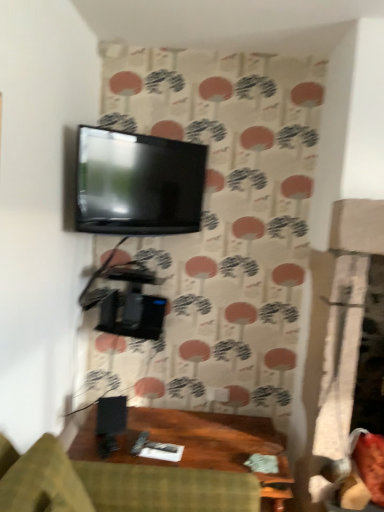
Question: Is green fabric studio couch at lower center with matte black tv at upper center?

Choices:
 (A) no
 (B) yes

Answer: (A)

Question: From a real-world perspective, is green fabric studio couch at lower center over matte black tv at upper center?

Choices:
 (A) yes
 (B) no

Answer: (B)

Question: Is green fabric studio couch at lower center not inside matte black tv at upper center?

Choices:
 (A) no
 (B) yes

Answer: (B)

Question: Is matte black tv at upper center surrounded by green fabric studio couch at lower center?

Choices:
 (A) yes
 (B) no

Answer: (B)

Question: Is green fabric studio couch at lower center to the left of matte black tv at upper center from the viewer's perspective?

Choices:
 (A) no
 (B) yes

Answer: (A)

Question: Does green fabric studio couch at lower center have a larger size compared to matte black tv at upper center?

Choices:
 (A) yes
 (B) no

Answer: (A)

Question: Considering the relative sizes of matte black tv at upper center and green fabric studio couch at lower center in the image provided, is matte black tv at upper center wider than green fabric studio couch at lower center?

Choices:
 (A) yes
 (B) no

Answer: (B)

Question: Is matte black tv at upper center positioned with its back to green fabric studio couch at lower center?

Choices:
 (A) no
 (B) yes

Answer: (A)

Question: Is matte black tv at upper center not within green fabric studio couch at lower center?

Choices:
 (A) yes
 (B) no

Answer: (A)

Question: Does matte black tv at upper center appear on the left side of green fabric studio couch at lower center?

Choices:
 (A) no
 (B) yes

Answer: (B)

Question: Is matte black tv at upper center thinner than green fabric studio couch at lower center?

Choices:
 (A) yes
 (B) no

Answer: (A)

Question: Does matte black tv at upper center appear on the right side of green fabric studio couch at lower center?

Choices:
 (A) no
 (B) yes

Answer: (A)

Question: From a real-world perspective, is black matte speaker at lower center beneath green fabric studio couch at lower center?

Choices:
 (A) no
 (B) yes

Answer: (A)